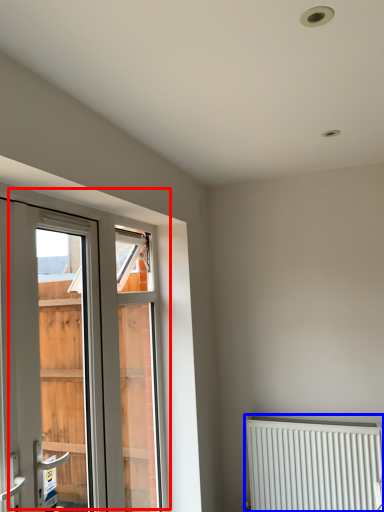
Question: Which object is closer to the camera taking this photo, window (highlighted by a red box) or radiator (highlighted by a blue box)?

Choices:
 (A) window
 (B) radiator

Answer: (A)